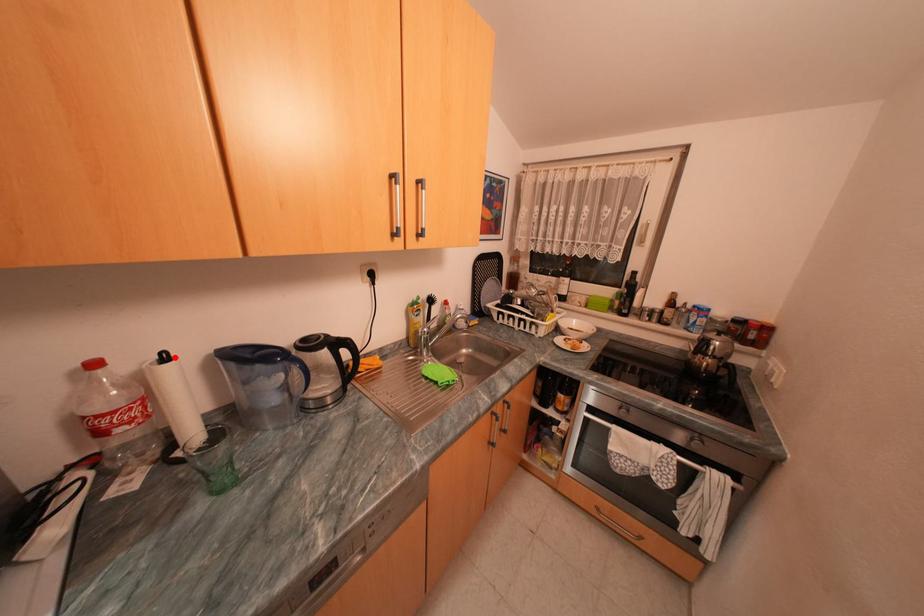
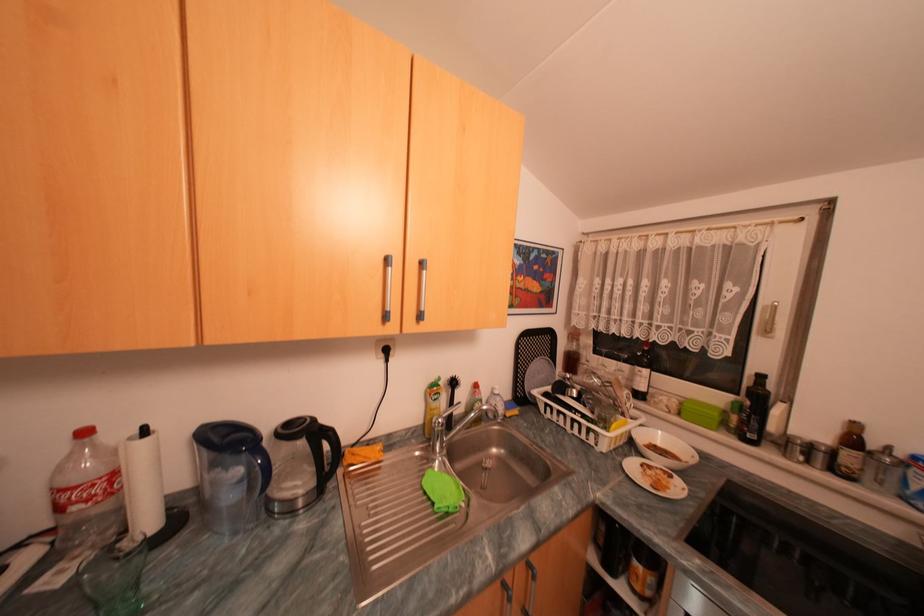
Question: I am providing you with two images of the same scene from different viewpoints. A red point is marked on the first image. At the location where the point appears in image 1, is it still visible in image 2?

Choices:
 (A) Yes
 (B) No

Answer: (A)